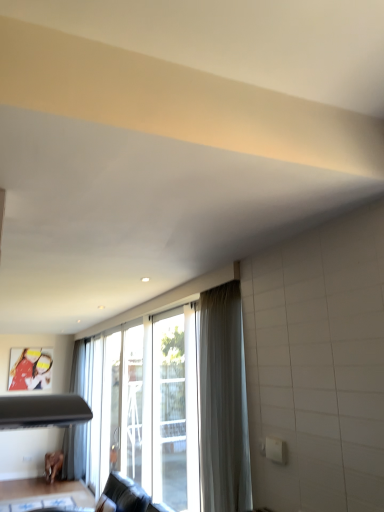
Question: Considering the positions of clear glass screen door at center, which is the first screen door in left-to-right order, and brown wooden table at lower left in the image, is clear glass screen door at center, which is the first screen door in left-to-right order, bigger or smaller than brown wooden table at lower left?

Choices:
 (A) big
 (B) small

Answer: (A)

Question: Considering their positions, is clear glass screen door at center, marked as the 1th screen door in a back-to-front arrangement, located in front of or behind brown wooden table at lower left?

Choices:
 (A) behind
 (B) front

Answer: (B)

Question: Considering the real-world distances, which object is farthest from the transparent glass screen door at center, arranged as the second screen door when viewed from the left?

Choices:
 (A) brown wooden table at lower left
 (B) clear glass screen door at center, marked as the 1th screen door in a back-to-front arrangement
 (C) white sheer curtain at center

Answer: (A)

Question: Which is nearer to the transparent glass screen door at center, arranged as the second screen door when viewed from the left?

Choices:
 (A) brown wooden table at lower left
 (B) white sheer curtain at center
 (C) clear glass screen door at center, which is the first screen door in left-to-right order

Answer: (C)